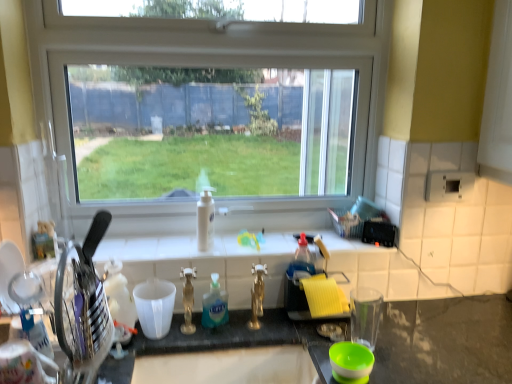
Locate an element on the screen. vacant area situated to the left side of white glossy bottle at center, which ranks as the second bottle in bottom-to-top order is located at coordinates (158, 247).